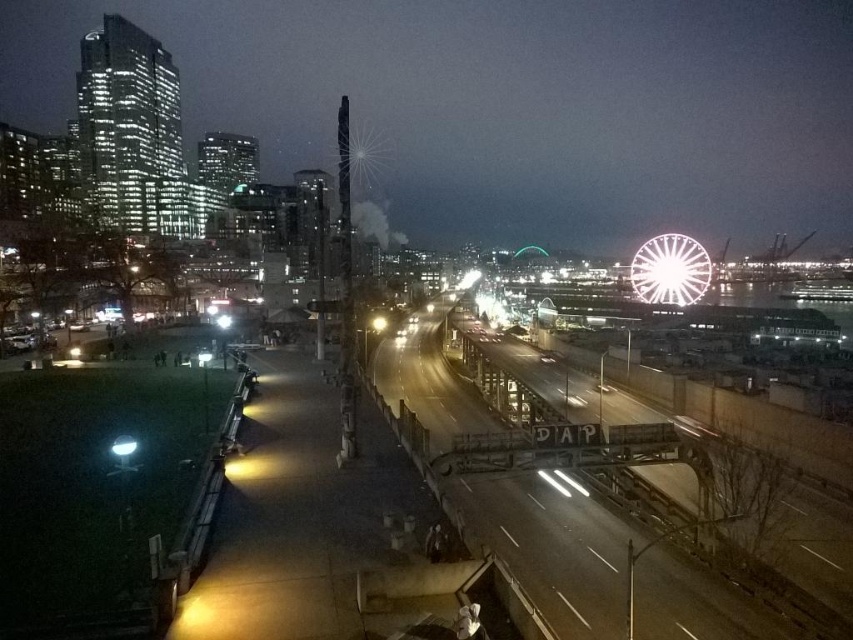
Is the position of metallic bridge at center less distant than that of bright white metallic ferris wheel at upper right?

Yes.

This screenshot has height=640, width=853. Identify the location of metallic bridge at center. (555, 547).